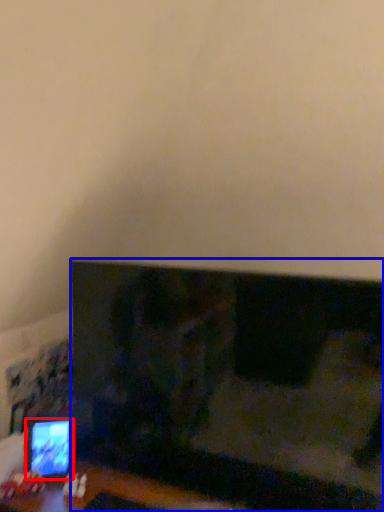
Question: Among these objects, which one is nearest to the camera, computer monitor (highlighted by a red box) or television (highlighted by a blue box)?

Choices:
 (A) computer monitor
 (B) television

Answer: (B)